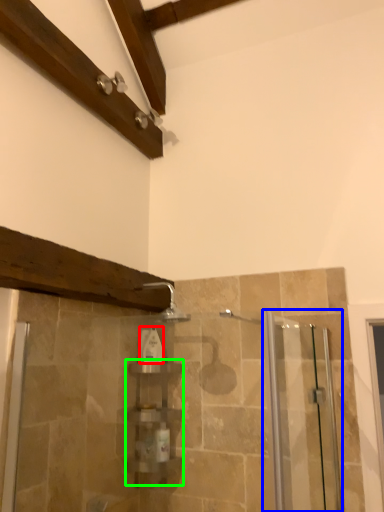
Question: Considering the real-world distances, which object is farthest from toiletry (highlighted by a red box)? screen door (highlighted by a blue box) or shelf (highlighted by a green box)?

Choices:
 (A) screen door
 (B) shelf

Answer: (A)